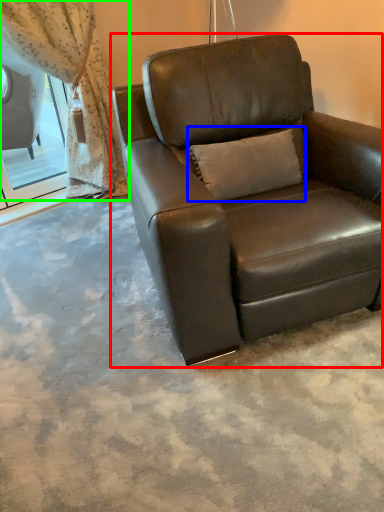
Question: Estimate the real-world distances between objects in this image. Which object is closer to chair (highlighted by a red box), pillow (highlighted by a blue box) or curtain (highlighted by a green box)?

Choices:
 (A) pillow
 (B) curtain

Answer: (A)